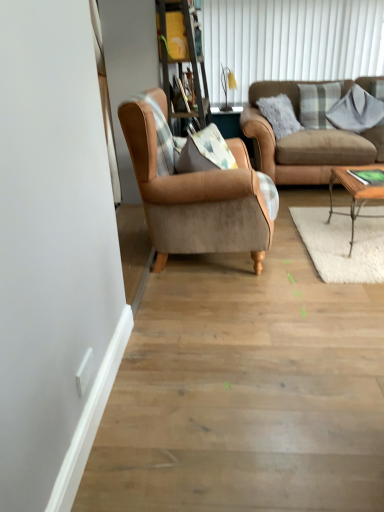
Question: Is woodenwoodencoffee table at right positioned behind wooden bookshelf at upper center?

Choices:
 (A) yes
 (B) no

Answer: (B)

Question: Does woodenwoodencoffee table at right have a smaller size compared to wooden bookshelf at upper center?

Choices:
 (A) no
 (B) yes

Answer: (B)

Question: Would you say woodenwoodencoffee table at right contains wooden bookshelf at upper center?

Choices:
 (A) yes
 (B) no

Answer: (B)

Question: Are woodenwoodencoffee table at right and wooden bookshelf at upper center far apart?

Choices:
 (A) no
 (B) yes

Answer: (B)

Question: From the image's perspective, is woodenwoodencoffee table at right beneath wooden bookshelf at upper center?

Choices:
 (A) yes
 (B) no

Answer: (A)

Question: Is point (370, 115) closer or farther from the camera than point (208, 41)?

Choices:
 (A) farther
 (B) closer

Answer: (B)

Question: Is gray cotton pillow at upper right, the first pillow from the right, in front of or behind white textured shutter at upper center in the image?

Choices:
 (A) behind
 (B) front

Answer: (B)

Question: Considering the positions of gray cotton pillow at upper right, the first pillow from the right, and white textured shutter at upper center in the image, is gray cotton pillow at upper right, the first pillow from the right, taller or shorter than white textured shutter at upper center?

Choices:
 (A) tall
 (B) short

Answer: (B)

Question: From the image's perspective, is gray cotton pillow at upper right, which is the 2th pillow from left to right, located above or below white textured shutter at upper center?

Choices:
 (A) above
 (B) below

Answer: (B)

Question: Considering the positions of matte yellow lampshade at upper center and plaid fabric pillow at upper right, which is the second pillow in right-to-left order, in the image, is matte yellow lampshade at upper center taller or shorter than plaid fabric pillow at upper right, which is the second pillow in right-to-left order,?

Choices:
 (A) tall
 (B) short

Answer: (A)

Question: From the image's perspective, is matte yellow lampshade at upper center located above or below plaid fabric pillow at upper right, acting as the first pillow starting from the left?

Choices:
 (A) above
 (B) below

Answer: (A)

Question: Is matte yellow lampshade at upper center wider or thinner than plaid fabric pillow at upper right, acting as the first pillow starting from the left?

Choices:
 (A) thin
 (B) wide

Answer: (A)

Question: Based on their positions, is matte yellow lampshade at upper center located to the left or right of plaid fabric pillow at upper right, acting as the first pillow starting from the left?

Choices:
 (A) left
 (B) right

Answer: (A)

Question: In the image, is wooden bookshelf at upper center positioned in front of or behind woodenwoodencoffee table at right?

Choices:
 (A) front
 (B) behind

Answer: (B)

Question: From a real-world perspective, is wooden bookshelf at upper center positioned above or below woodenwoodencoffee table at right?

Choices:
 (A) below
 (B) above

Answer: (B)